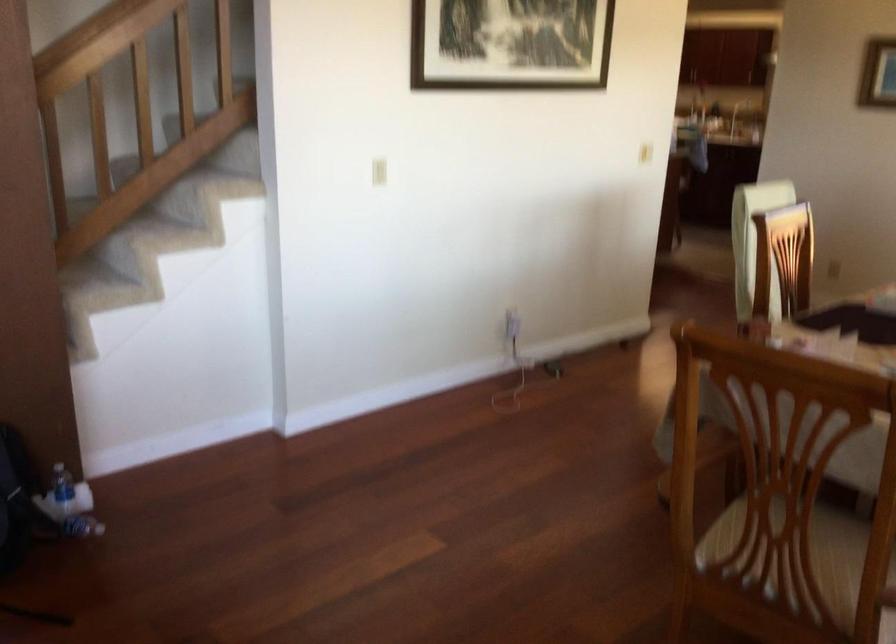
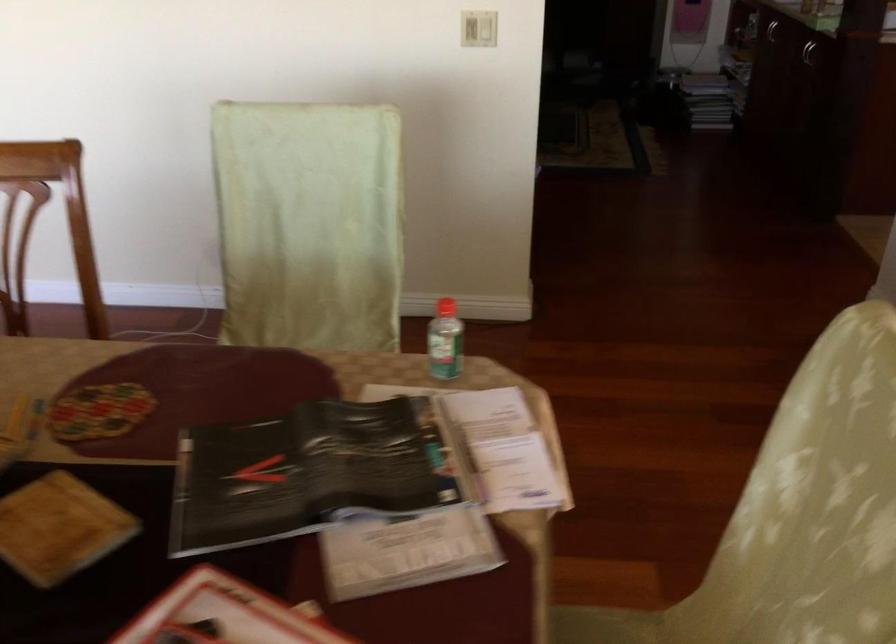
In the second image, find the point that corresponds to [643,147] in the first image.

(478, 29)